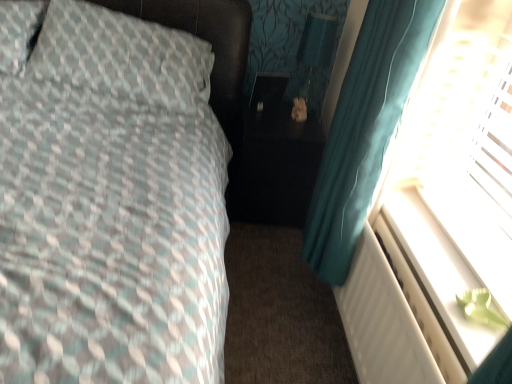
Question: Is black glossy side table at center to the right of matte black table lamp at center from the viewer's perspective?

Choices:
 (A) yes
 (B) no

Answer: (B)

Question: Is black glossy side table at center facing away from matte black table lamp at center?

Choices:
 (A) yes
 (B) no

Answer: (B)

Question: Considering the relative sizes of black glossy side table at center and matte black table lamp at center in the image provided, is black glossy side table at center wider than matte black table lamp at center?

Choices:
 (A) yes
 (B) no

Answer: (A)

Question: Does black glossy side table at center appear on the left side of matte black table lamp at center?

Choices:
 (A) yes
 (B) no

Answer: (A)

Question: Is black glossy side table at center oriented towards matte black table lamp at center?

Choices:
 (A) no
 (B) yes

Answer: (A)

Question: Is black glossy side table at center in front of matte black table lamp at center?

Choices:
 (A) no
 (B) yes

Answer: (B)

Question: From the image's perspective, is transparent plastic screen at right on top of black glossy side table at center?

Choices:
 (A) no
 (B) yes

Answer: (A)

Question: Is transparent plastic screen at right not close to black glossy side table at center?

Choices:
 (A) yes
 (B) no

Answer: (B)

Question: Is transparent plastic screen at right outside of black glossy side table at center?

Choices:
 (A) yes
 (B) no

Answer: (A)

Question: Is the depth of transparent plastic screen at right less than that of black glossy side table at center?

Choices:
 (A) no
 (B) yes

Answer: (B)

Question: Is transparent plastic screen at right positioned with its back to black glossy side table at center?

Choices:
 (A) yes
 (B) no

Answer: (B)

Question: Considering the relative positions of transparent plastic screen at right and black glossy side table at center in the image provided, is transparent plastic screen at right to the left of black glossy side table at center from the viewer's perspective?

Choices:
 (A) no
 (B) yes

Answer: (A)

Question: From a real-world perspective, is matte black table lamp at center over black glossy side table at center?

Choices:
 (A) yes
 (B) no

Answer: (A)